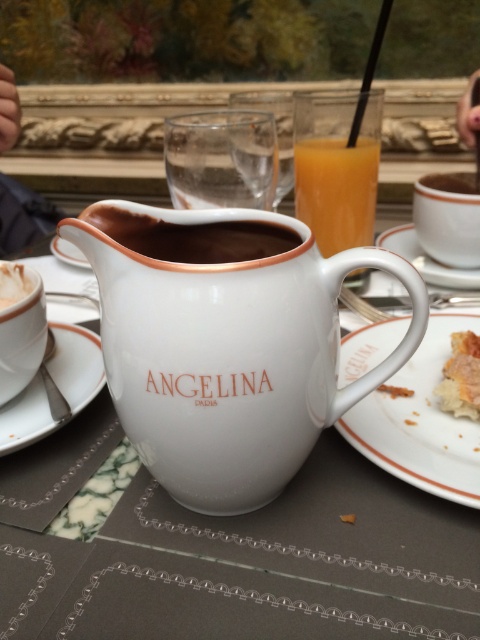
Question: Which of the following is the farthest from the observer?

Choices:
 (A) white ceramic plate at lower right
 (B) brown matte coffee cup at center
 (C) orange liquid at upper center

Answer: (B)

Question: Does white ceramic saucer at lower left have a lesser width compared to matte white latte at left?

Choices:
 (A) no
 (B) yes

Answer: (A)

Question: Which object is positioned farthest from the white ceramic plate at lower right?

Choices:
 (A) brown matte coffee cup at center
 (B) matte white latte at left
 (C) orange liquid at upper center
 (D) white matte cup at center

Answer: (A)

Question: Based on their relative distances, which object is farther from the brown matte coffee cup at center?

Choices:
 (A) white ceramic plate at lower right
 (B) matte white latte at left
 (C) orange liquid at upper center

Answer: (B)

Question: Does white ceramic plate at lower right have a greater width compared to brown matte coffee cup at center?

Choices:
 (A) yes
 (B) no

Answer: (A)

Question: Can you confirm if white ceramic pitcher at center is positioned below orange liquid at upper center?

Choices:
 (A) no
 (B) yes

Answer: (B)